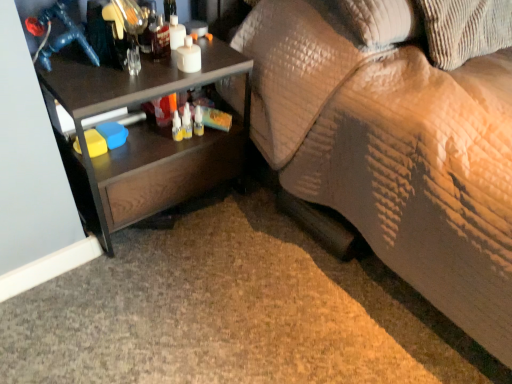
What do you see at coordinates (394, 153) in the screenshot? The image size is (512, 384). I see `textured beige couch at lower right` at bounding box center [394, 153].

Locate an element on the screen. brown corduroy pillow at upper right is located at coordinates 465,29.

Between dark wood desk at left and brown corduroy pillow at upper right, which one has larger width?

Wider between the two is brown corduroy pillow at upper right.

Is point (141, 57) closer or farther from the camera than point (465, 31)?

Point (141, 57) appears to be closer to the viewer than point (465, 31).

Is dark wood desk at left aimed at brown corduroy pillow at upper right?

No, dark wood desk at left is not facing towards brown corduroy pillow at upper right.

Between dark wood desk at left and textured beige couch at lower right, which one has smaller size?

dark wood desk at left.

Consider the image. How far apart are dark wood desk at left and textured beige couch at lower right?

39.70 centimeters.

From a real-world perspective, between dark wood desk at left and textured beige couch at lower right, who is vertically lower?

In real-world perspective, dark wood desk at left is lower.

Considering the positions of objects dark wood desk at left and textured beige couch at lower right in the image provided, who is behind, dark wood desk at left or textured beige couch at lower right?

dark wood desk at left is behind.

Which object is wider, textured beige couch at lower right or brown corduroy pillow at upper right?

textured beige couch at lower right.

Considering the relative positions of textured beige couch at lower right and brown corduroy pillow at upper right in the image provided, is textured beige couch at lower right to the left of brown corduroy pillow at upper right from the viewer's perspective?

No, textured beige couch at lower right is not to the left of brown corduroy pillow at upper right.

From a real-world perspective, which is physically above, textured beige couch at lower right or brown corduroy pillow at upper right?

From a 3D spatial view, brown corduroy pillow at upper right is above.

Is brown corduroy pillow at upper right not within textured beige couch at lower right?

Actually, brown corduroy pillow at upper right is within textured beige couch at lower right.

Is brown corduroy pillow at upper right positioned with its back to textured beige couch at lower right?

Yes, textured beige couch at lower right is at the back of brown corduroy pillow at upper right.

From the image's perspective, relative to textured beige couch at lower right, is brown corduroy pillow at upper right above or below?

From the image's perspective, brown corduroy pillow at upper right appears above textured beige couch at lower right.

Would you say brown corduroy pillow at upper right is to the left or to the right of dark wood desk at left in the picture?

From the image, it's evident that brown corduroy pillow at upper right is to the right of dark wood desk at left.

Is brown corduroy pillow at upper right not near dark wood desk at left?

No, brown corduroy pillow at upper right is in close proximity to dark wood desk at left.

Can you tell me how much brown corduroy pillow at upper right and dark wood desk at left differ in facing direction?

The angle between the facing direction of brown corduroy pillow at upper right and the facing direction of dark wood desk at left is 2.4 degrees.

How distant is brown corduroy pillow at upper right from dark wood desk at left?

brown corduroy pillow at upper right is 31.79 inches from dark wood desk at left.

Is textured beige couch at lower right outside of dark wood desk at left?

Yes.

Is textured beige couch at lower right bigger than dark wood desk at left?

Yes.

Is textured beige couch at lower right next to dark wood desk at left?

No, textured beige couch at lower right is not in contact with dark wood desk at left.

Measure the distance between textured beige couch at lower right and dark wood desk at left.

The distance of textured beige couch at lower right from dark wood desk at left is 15.63 inches.

Locate an element on the screen. This screenshot has height=384, width=512. pillow above the dark wood desk at left (from a real-world perspective) is located at coordinates (465, 29).

This screenshot has height=384, width=512. What are the coordinates of `studio couch that is on the right side of dark wood desk at left` in the screenshot? It's located at (394, 153).

From the image, which object appears to be nearer to textured beige couch at lower right, dark wood desk at left or brown corduroy pillow at upper right?

brown corduroy pillow at upper right lies closer to textured beige couch at lower right than the other object.

Based on their spatial positions, is brown corduroy pillow at upper right or dark wood desk at left further from textured beige couch at lower right?

dark wood desk at left.

Consider the image. When comparing their distances from dark wood desk at left, does brown corduroy pillow at upper right or textured beige couch at lower right seem further?

brown corduroy pillow at upper right.

Considering their positions, is textured beige couch at lower right positioned further to brown corduroy pillow at upper right than dark wood desk at left?

Based on the image, dark wood desk at left appears to be further to brown corduroy pillow at upper right.

Estimate the real-world distances between objects in this image. Which object is closer to brown corduroy pillow at upper right, dark wood desk at left or textured beige couch at lower right?

Among the two, textured beige couch at lower right is located nearer to brown corduroy pillow at upper right.

Based on their spatial positions, is textured beige couch at lower right or brown corduroy pillow at upper right further from dark wood desk at left?

brown corduroy pillow at upper right is positioned further to the anchor dark wood desk at left.

Where is `pillow between dark wood desk at left and textured beige couch at lower right`? Image resolution: width=512 pixels, height=384 pixels. pillow between dark wood desk at left and textured beige couch at lower right is located at coordinates (465, 29).